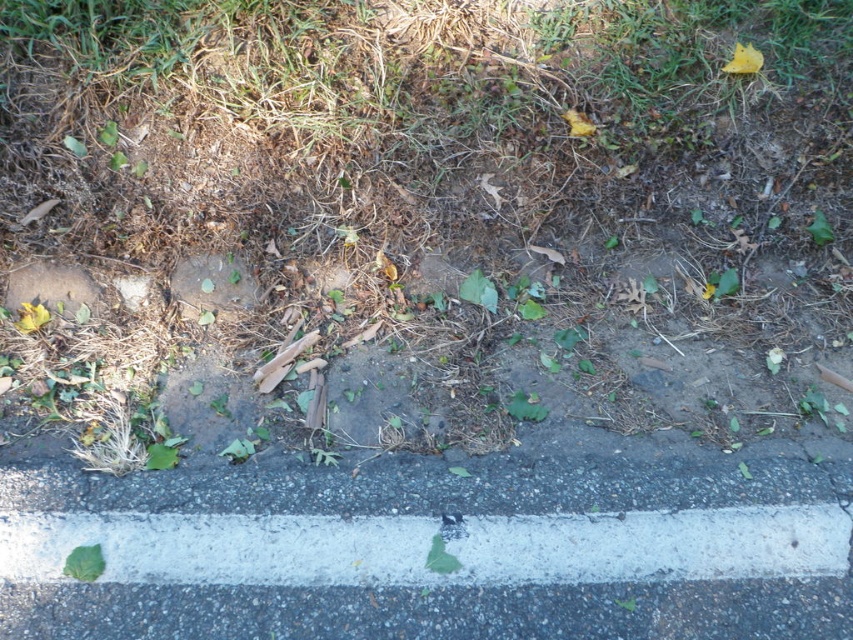
Question: Does white painted curb at lower center appear over green leafy weed at lower center?

Choices:
 (A) no
 (B) yes

Answer: (B)

Question: Which of the following is the farthest from the observer?

Choices:
 (A) (149, 545)
 (B) (70, 577)

Answer: (A)

Question: Where is green leafy grass at center located in relation to green leafy at lower left in the image?

Choices:
 (A) below
 (B) above

Answer: (B)

Question: Which point appears farthest from the camera in this image?

Choices:
 (A) (218, 545)
 (B) (148, 65)
 (C) (71, 557)

Answer: (B)

Question: Which of the following is the closest to the observer?

Choices:
 (A) green leafy weed at lower center
 (B) green leafy grass at center
 (C) white painted curb at lower center

Answer: (C)

Question: Can you confirm if green leafy grass at center is thinner than green leafy weed at lower center?

Choices:
 (A) no
 (B) yes

Answer: (A)